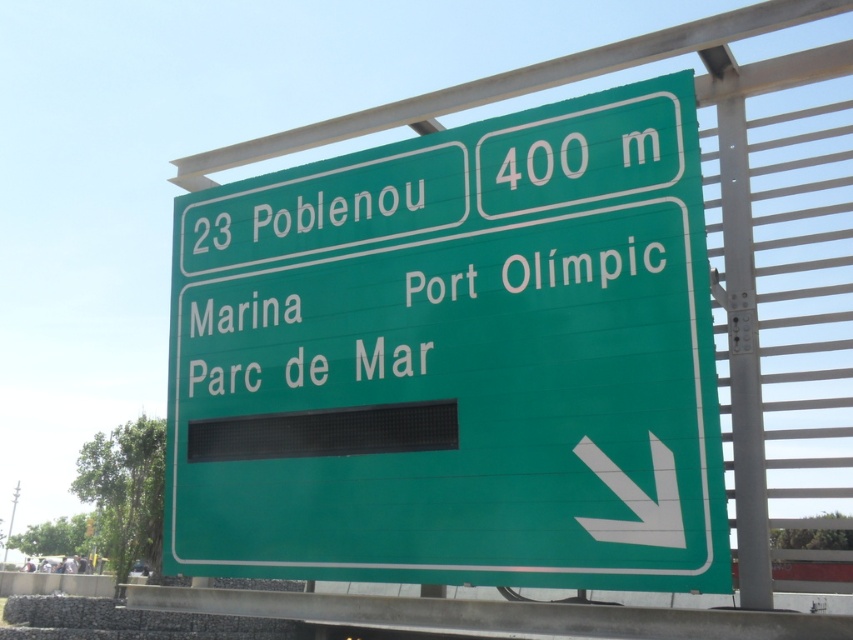
From the picture: Can you confirm if green matte sign at center is positioned below green metallic sign at center?

Yes.

Is point (722, 500) positioned behind point (450, 291)?

No, (722, 500) is closer to viewer.

This screenshot has height=640, width=853. Identify the location of green matte sign at center. (456, 358).

Between green matte sign at center and green matte sign at upper center, which one appears on the right side from the viewer's perspective?

Positioned to the right is green matte sign at upper center.

From the picture: Which of these two, green matte sign at center or green matte sign at upper center, stands taller?

Standing taller between the two is green matte sign at center.

Which is in front, point (440, 512) or point (585, 100)?

Point (440, 512)

Where is `green matte sign at center`? The image size is (853, 640). green matte sign at center is located at coordinates tap(456, 358).

Can you confirm if green matte sign at upper center is positioned below green metallic sign at center?

Actually, green matte sign at upper center is above green metallic sign at center.

Measure the distance between green matte sign at upper center and camera.

green matte sign at upper center is 5.26 meters from camera.

The width and height of the screenshot is (853, 640). Find the location of `green matte sign at upper center`. green matte sign at upper center is located at coordinates (445, 180).